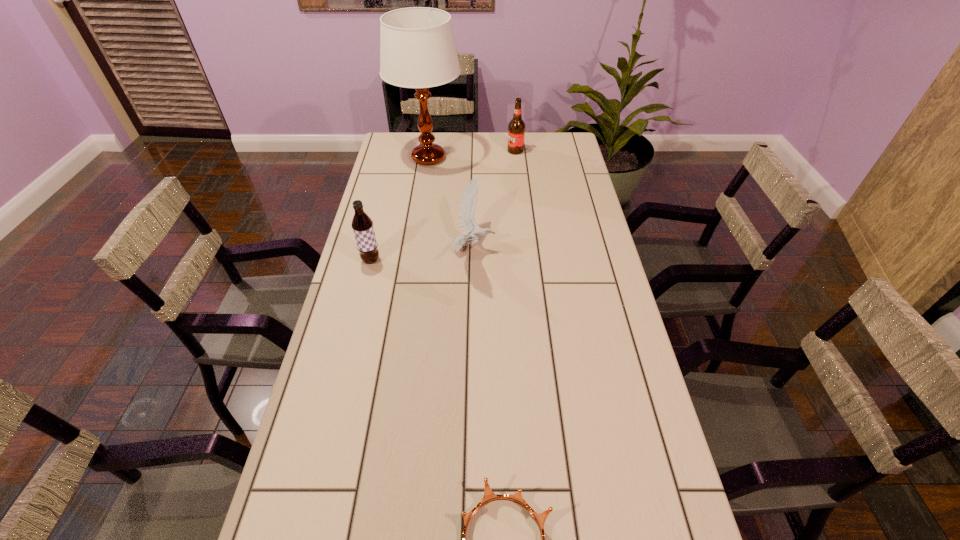
At what (x,y) coordinates should I click in order to perform the action: click on table lamp positioned at the left edge. Please return your answer as a coordinate pair (x, y). The height and width of the screenshot is (540, 960). Looking at the image, I should click on (417, 47).

Find the location of a particular element. The image size is (960, 540). root beer present at the left edge is located at coordinates (362, 224).

This screenshot has height=540, width=960. Identify the location of object positioned at the far left corner. (417, 47).

This screenshot has height=540, width=960. Find the location of `free space at the left edge of the desktop`. free space at the left edge of the desktop is located at coordinates (352, 276).

Identify the location of free space at the right edge of the desktop. (586, 222).

What are the coordinates of `vacant space at the far left corner of the desktop` in the screenshot? It's located at (407, 147).

I want to click on vacant space at the far right corner of the desktop, so click(x=551, y=139).

Image resolution: width=960 pixels, height=540 pixels. Identify the location of unoccupied position between the table lamp and the farther root beer. 472,154.

Locate an element on the screen. blank region between the second shortest object and the table lamp is located at coordinates (451, 204).

You are a GUI agent. You are given a task and a screenshot of the screen. Output one action in this format:
    pyautogui.click(x=<x>, y=<y>)
    Task: Click on the free spot between the table lamp and the second shortest object
    The image size is (960, 540).
    Given the screenshot: What is the action you would take?
    pyautogui.click(x=451, y=204)